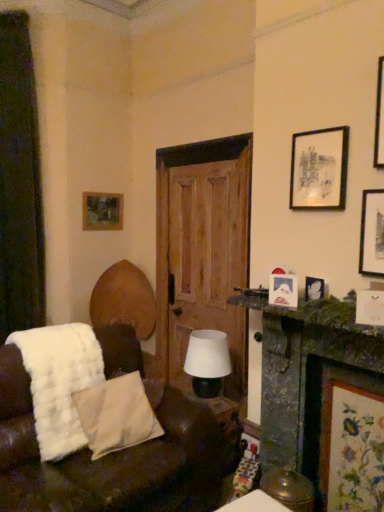
The height and width of the screenshot is (512, 384). Describe the element at coordinates (349, 438) in the screenshot. I see `floral fabric picture frame at lower right, the first picture frame positioned from the bottom` at that location.

The height and width of the screenshot is (512, 384). Describe the element at coordinates (118, 413) in the screenshot. I see `white soft pillow at lower left` at that location.

Measure the distance between wooden picture frame at upper left, the 1th picture frame when ordered from left to right, and camera.

wooden picture frame at upper left, the 1th picture frame when ordered from left to right, and camera are 3.81 meters apart from each other.

This screenshot has height=512, width=384. What do you see at coordinates (202, 251) in the screenshot?
I see `wooden door at center` at bounding box center [202, 251].

Describe the element at coordinates (19, 182) in the screenshot. I see `dark green fabric curtain at left` at that location.

What do you see at coordinates (283, 290) in the screenshot? I see `matte white picture frame at right, positioned as the 3th picture frame in back-to-front order` at bounding box center [283, 290].

Locate an element on the screen. The height and width of the screenshot is (512, 384). white matte table lamp at center is located at coordinates (207, 362).

From the image's perspective, which is above, dark green fabric curtain at left or matte white picture frame at upper right, the 2th picture frame when ordered from right to left?

dark green fabric curtain at left appears higher in the image.

Consider the image. Which is more distant, (30,42) or (322,287)?

Point (30,42)

Who is shorter, dark green fabric curtain at left or matte white picture frame at upper right, acting as the 4th picture frame starting from the left?

matte white picture frame at upper right, acting as the 4th picture frame starting from the left.

Is dark green fabric curtain at left oriented towards matte white picture frame at upper right, the 4th picture frame viewed from the top?

No, dark green fabric curtain at left is not aimed at matte white picture frame at upper right, the 4th picture frame viewed from the top.

Looking at the image, does wooden door at center seem bigger or smaller compared to white matte table lamp at center?

Clearly, wooden door at center is larger in size than white matte table lamp at center.

Considering the sizes of objects wooden door at center and white matte table lamp at center in the image provided, who is thinner, wooden door at center or white matte table lamp at center?

wooden door at center is thinner.

Looking at this image, is wooden door at center facing towards white matte table lamp at center?

Yes, wooden door at center is facing white matte table lamp at center.

Who is taller, wooden door at center or white matte table lamp at center?

wooden door at center is taller.

Which object is closer to the camera taking this photo, wooden door at center or white fluffy blanket at lower left?

white fluffy blanket at lower left is in front.

From a real-world perspective, who is located higher, wooden door at center or white fluffy blanket at lower left?

From a 3D spatial view, wooden door at center is above.

Which of these two, wooden door at center or white fluffy blanket at lower left, is smaller?

white fluffy blanket at lower left is smaller.

Could you measure the distance between dark green fabric curtain at left and floral fabric picture frame at lower right, which is the 1th picture frame from right to left?

The distance of dark green fabric curtain at left from floral fabric picture frame at lower right, which is the 1th picture frame from right to left, is 9.10 feet.

Could you tell me if dark green fabric curtain at left is facing floral fabric picture frame at lower right, which appears as the fifth picture frame when viewed from the back?

No, dark green fabric curtain at left is not facing towards floral fabric picture frame at lower right, which appears as the fifth picture frame when viewed from the back.

From the image's perspective, would you say dark green fabric curtain at left is shown under floral fabric picture frame at lower right, positioned as the 5th picture frame in top-to-bottom order?

No.

Can floral fabric picture frame at lower right, which is the 1th picture frame from right to left, be found inside dark green fabric curtain at left?

No, floral fabric picture frame at lower right, which is the 1th picture frame from right to left, is located outside of dark green fabric curtain at left.

Considering the points (274, 294) and (15, 328), which point is behind, point (274, 294) or point (15, 328)?

The point (15, 328) is farther from the camera.

In the scene shown: In terms of height, does matte white picture frame at right, the 3th picture frame positioned from the front, look taller or shorter compared to dark green fabric curtain at left?

Considering their sizes, matte white picture frame at right, the 3th picture frame positioned from the front, has less height than dark green fabric curtain at left.

Consider the image. Which of these two, matte white picture frame at right, the third picture frame positioned from the top, or dark green fabric curtain at left, is smaller?

matte white picture frame at right, the third picture frame positioned from the top.

Is matte white picture frame at right, the 3th picture frame positioned from the front, oriented away from dark green fabric curtain at left?

matte white picture frame at right, the 3th picture frame positioned from the front, is not turned away from dark green fabric curtain at left.

From the image's perspective, who appears lower, white fluffy blanket at lower left or wooden picture frame at upper left, the 1th picture frame when ordered from left to right?

From the image's view, white fluffy blanket at lower left is below.

Is white fluffy blanket at lower left oriented towards wooden picture frame at upper left, the 1th picture frame when ordered from back to front?

No, white fluffy blanket at lower left is not facing towards wooden picture frame at upper left, the 1th picture frame when ordered from back to front.

Identify the location of blanket in front of the wooden picture frame at upper left, which is counted as the second picture frame, starting from the top. (59, 382).

From a real-world perspective, is white fluffy blanket at lower left on wooden picture frame at upper left, the 1th picture frame when ordered from back to front?

Incorrect, from a real-world perspective, white fluffy blanket at lower left is lower than wooden picture frame at upper left, the 1th picture frame when ordered from back to front.

Which is closer to the camera, (86, 200) or (322, 280)?

Positioned in front is point (322, 280).

Is there a large distance between wooden picture frame at upper left, which appears as the fifth picture frame when viewed from the right, and matte white picture frame at upper right, the 2th picture frame when ordered from right to left?

Yes, wooden picture frame at upper left, which appears as the fifth picture frame when viewed from the right, and matte white picture frame at upper right, the 2th picture frame when ordered from right to left, are located far from each other.

Which object is thinner, wooden picture frame at upper left, the 4th picture frame when ordered from bottom to top, or matte white picture frame at upper right, the 4th picture frame viewed from the top?

With smaller width is wooden picture frame at upper left, the 4th picture frame when ordered from bottom to top.

The width and height of the screenshot is (384, 512). I want to click on picture frame that is the 4th one when counting downward from the dark green fabric curtain at left (from the image's perspective), so click(314, 288).

You are a GUI agent. You are given a task and a screenshot of the screen. Output one action in this format:
    pyautogui.click(x=<x>, y=<y>)
    Task: Click on the table lamp on the right side of wooden door at center
    
    Given the screenshot: What is the action you would take?
    pyautogui.click(x=207, y=362)

From the image, which object appears to be nearer to dark green fabric curtain at left, white fluffy blanket at lower left or wooden picture frame at upper left, the 1th picture frame when ordered from left to right?

wooden picture frame at upper left, the 1th picture frame when ordered from left to right, is positioned closer to the anchor dark green fabric curtain at left.

Based on their spatial positions, is wooden picture frame at upper left, which is counted as the second picture frame, starting from the top, or white matte table lamp at center further from floral fabric picture frame at lower right, placed as the 1th picture frame when sorted from front to back?

wooden picture frame at upper left, which is counted as the second picture frame, starting from the top, is positioned further to the anchor floral fabric picture frame at lower right, placed as the 1th picture frame when sorted from front to back.

Which object lies further to the anchor point white fluffy blanket at lower left, white soft pillow at lower left or dark green fabric curtain at left?

dark green fabric curtain at left lies further to white fluffy blanket at lower left than the other object.

Looking at the image, which one is located closer to wooden picture frame at upper left, the 1th picture frame when ordered from back to front, white fluffy blanket at lower left or matte white picture frame at upper right, acting as the 4th picture frame starting from the left?

white fluffy blanket at lower left lies closer to wooden picture frame at upper left, the 1th picture frame when ordered from back to front, than the other object.

Based on their spatial positions, is wooden door at center or white soft pillow at lower left closer to wooden picture frame at upper left, which is the fifth picture frame in front-to-back order?

The object closer to wooden picture frame at upper left, which is the fifth picture frame in front-to-back order, is wooden door at center.

From the image, which object appears to be farther from wooden door at center, white fluffy blanket at lower left or green mossy fireplace at right?

The object further to wooden door at center is white fluffy blanket at lower left.

When comparing their distances from wooden picture frame at upper left, which is counted as the second picture frame, starting from the top, does white soft pillow at lower left or white fluffy blanket at lower left seem closer?

white soft pillow at lower left is closer to wooden picture frame at upper left, which is counted as the second picture frame, starting from the top.

In the scene shown: Estimate the real-world distances between objects in this image. Which object is closer to floral fabric picture frame at lower right, positioned as the 5th picture frame in top-to-bottom order, white matte table lamp at center or wooden picture frame at upper left, which appears as the fifth picture frame when viewed from the right?

Among the two, white matte table lamp at center is located nearer to floral fabric picture frame at lower right, positioned as the 5th picture frame in top-to-bottom order.

At what (x,y) coordinates should I click in order to perform the action: click on fireplace located between white fluffy blanket at lower left and wooden picture frame at upper left, which is the fifth picture frame in front-to-back order, in the depth direction. Please return your answer as a coordinate pair (x, y). The width and height of the screenshot is (384, 512). Looking at the image, I should click on (308, 374).

Identify the location of pillow located between dark green fabric curtain at left and green mossy stone mantelpiece at right in the left-right direction. This screenshot has width=384, height=512. (118, 413).

The width and height of the screenshot is (384, 512). In order to click on mantle between green mossy fireplace at right and white matte table lamp at center in the front-back direction in this screenshot , I will do `click(312, 313)`.

Identify the location of fireplace located between white fluffy blanket at lower left and black matte picture frame at upper right, the 3th picture frame when ordered from right to left, in the left-right direction. The image size is (384, 512). (308, 374).